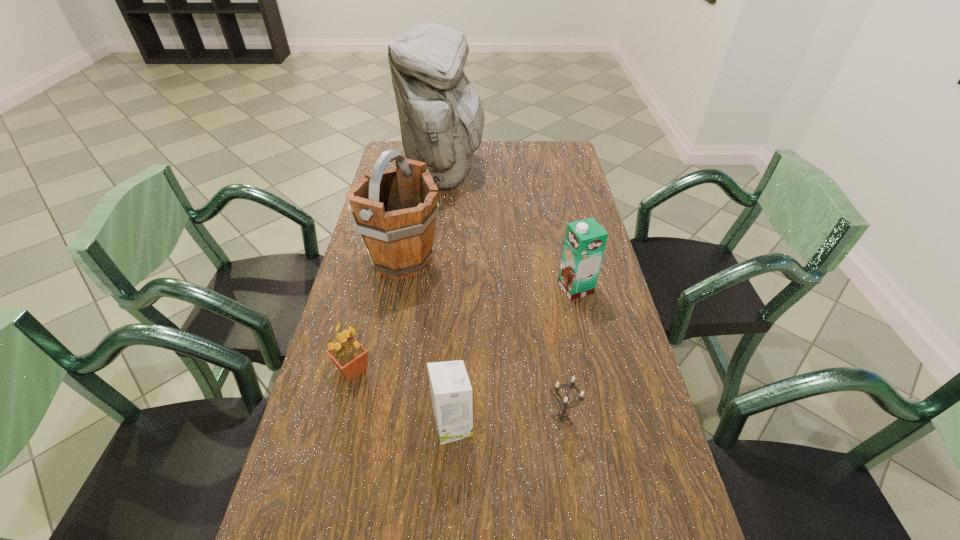
Where is `vacant space that's between the rightmost object and the bucket`? The width and height of the screenshot is (960, 540). vacant space that's between the rightmost object and the bucket is located at coordinates (489, 274).

I want to click on vacant space in between the left carton and the shortest object, so click(508, 423).

You are a GUI agent. You are given a task and a screenshot of the screen. Output one action in this format:
    pyautogui.click(x=<x>, y=<y>)
    Task: Click on the vacant space in between the bucket and the fourth farthest object
    This screenshot has width=960, height=540.
    Given the screenshot: What is the action you would take?
    pyautogui.click(x=377, y=314)

This screenshot has width=960, height=540. What are the coordinates of `free area in between the right carton and the fifth shortest object` in the screenshot? It's located at (489, 274).

Select which object is the fifth closest to the farthest object. Please provide its 2D coordinates. Your answer should be formatted as a tuple, i.e. [(x, y)], where the tuple contains the x and y coordinates of a point satisfying the conditions above.

[(562, 415)]

Where is `object that is the closest to the shortest object`? This screenshot has height=540, width=960. object that is the closest to the shortest object is located at coordinates tap(452, 399).

Identify the location of vacant area in the image that satisfies the following two spatial constraints: 1. on the front-facing side of the tallest object; 2. on the front side of the fifth shortest object. (436, 260).

Locate an element on the screen. The image size is (960, 540). vacant space that satisfies the following two spatial constraints: 1. on the front side of the shortest object; 2. on the left side of the second tallest object is located at coordinates (372, 420).

Where is `vacant area in the image that satisfies the following two spatial constraints: 1. at the front of the fourth farthest object with flowers visible; 2. on the back side of the shorter carton`? vacant area in the image that satisfies the following two spatial constraints: 1. at the front of the fourth farthest object with flowers visible; 2. on the back side of the shorter carton is located at coordinates (339, 426).

Locate an element on the screen. The image size is (960, 540). vacant space that satisfies the following two spatial constraints: 1. on the front-facing side of the farther carton; 2. on the right side of the tallest object is located at coordinates (433, 288).